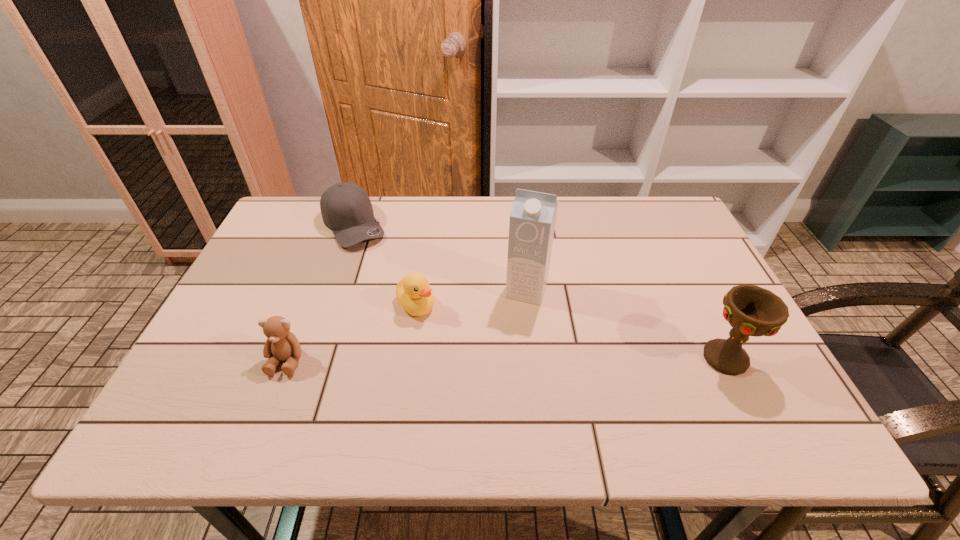
Locate an element on the screen. free spot on the desktop that is between the teddy bear and the rightmost object and is positioned on the front label of the tallest object is located at coordinates (503, 359).

Where is `free spot on the desktop that is between the teddy bear and the chalice and is positioned on the front brim of the farthest object`? free spot on the desktop that is between the teddy bear and the chalice and is positioned on the front brim of the farthest object is located at coordinates (447, 360).

Locate an element on the screen. vacant spot on the desktop that is between the teddy bear and the rightmost object and is positioned on the face of the duckling is located at coordinates (462, 360).